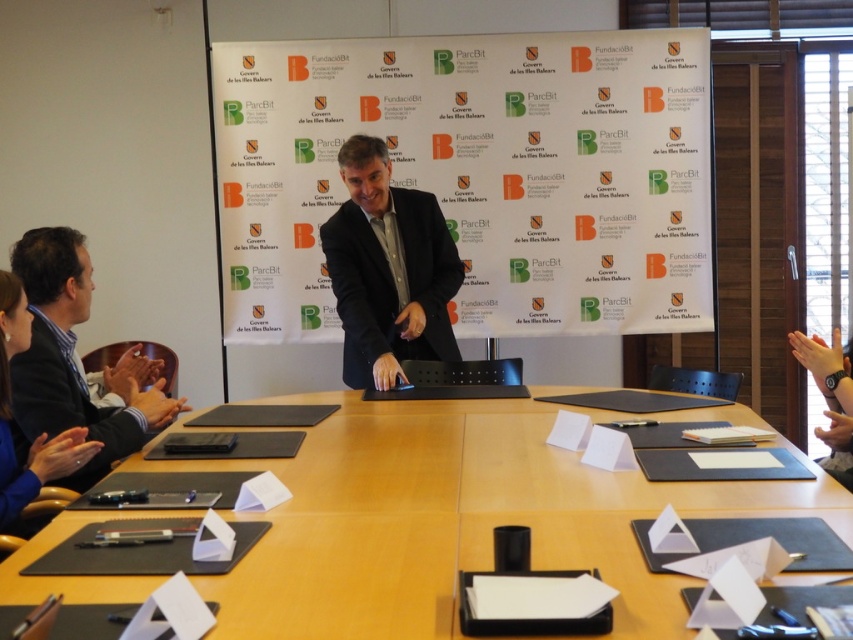
Question: Considering the relative positions of wooden table at center and black matte suit at center in the image provided, where is wooden table at center located with respect to black matte suit at center?

Choices:
 (A) left
 (B) right

Answer: (B)

Question: Which point is farther to the camera?

Choices:
 (A) (82, 481)
 (B) (618, 106)

Answer: (B)

Question: Which object appears closest to the camera in this image?

Choices:
 (A) blue fabric shirt at lower left
 (B) white paperboard at center
 (C) blue satin business suit at lower left

Answer: (A)

Question: Is black matte suit at center to the right of blue satin business suit at lower left from the viewer's perspective?

Choices:
 (A) no
 (B) yes

Answer: (B)

Question: Can you confirm if white paperboard at center is thinner than wooden table at center?

Choices:
 (A) no
 (B) yes

Answer: (A)

Question: Estimate the real-world distances between objects in this image. Which object is closer to the blue fabric shirt at lower left?

Choices:
 (A) blue satin business suit at lower left
 (B) white paperboard at center
 (C) wooden table at center
 (D) black matte suit at center

Answer: (A)